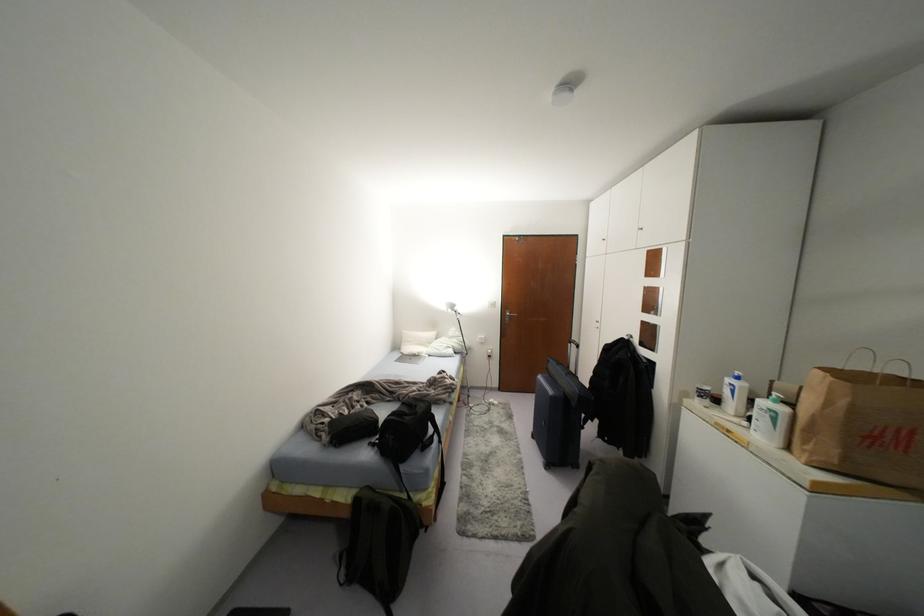
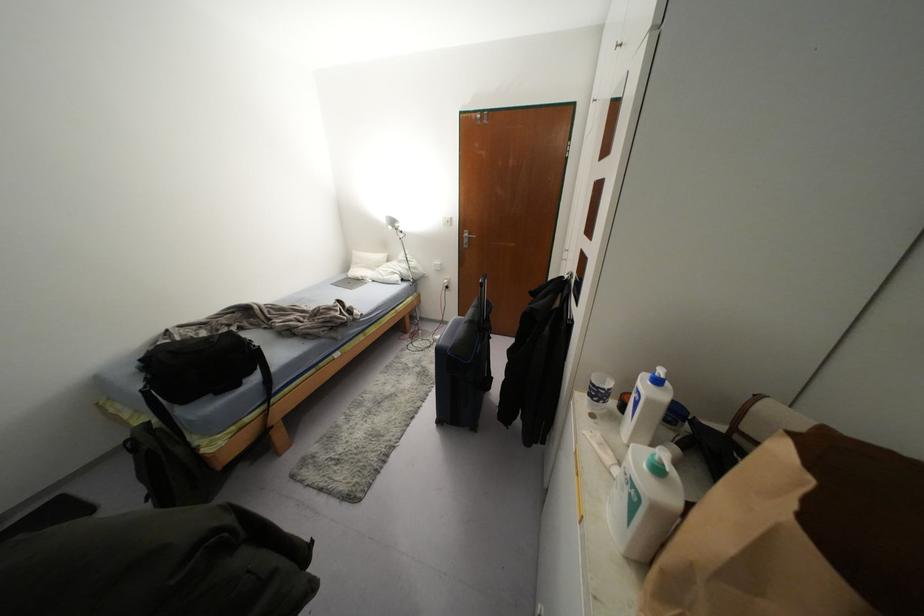
Find the pixel in the second image that matches point (455, 308) in the first image.

(395, 225)